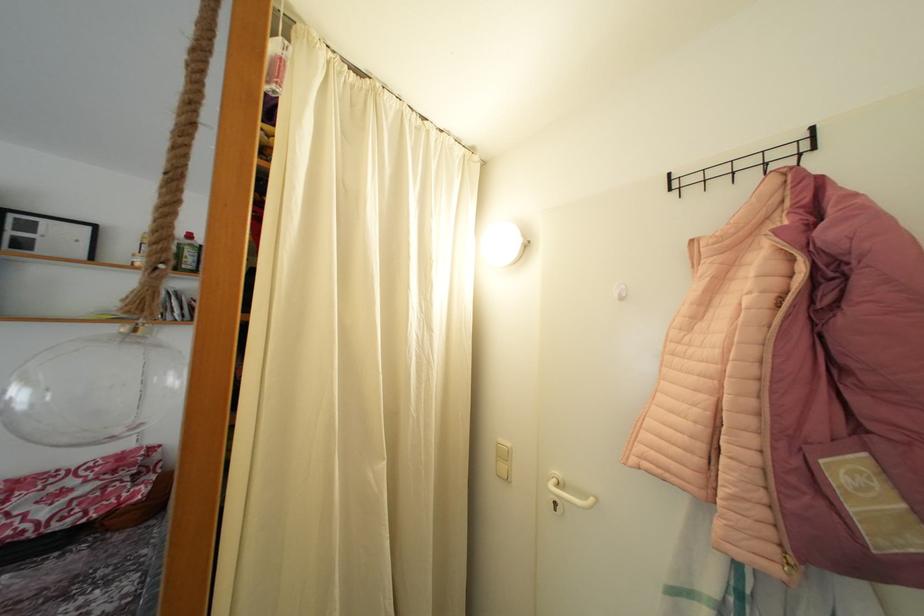
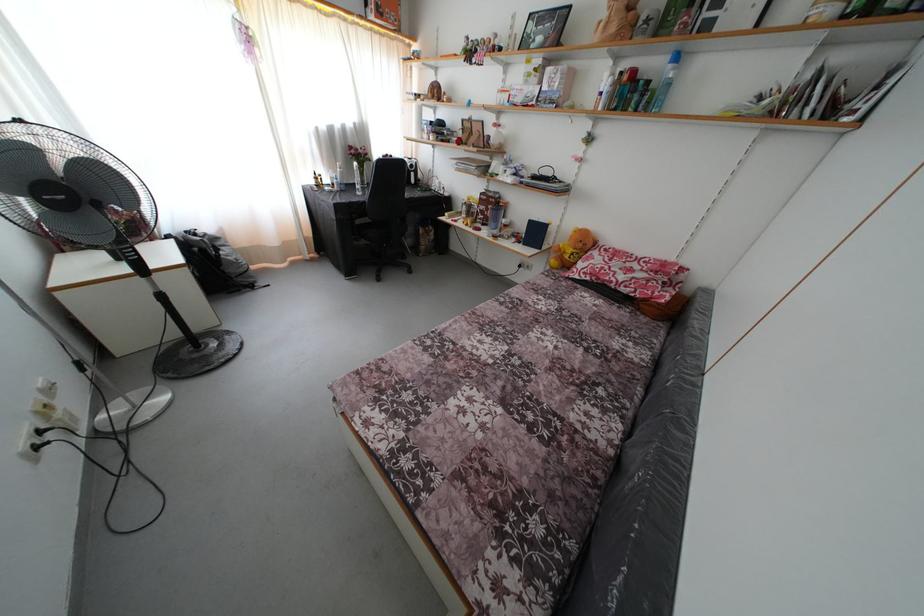
The first image is from the beginning of the video and the second image is from the end. How did the camera likely rotate when shooting the video?

The camera's rotation is toward left-down.